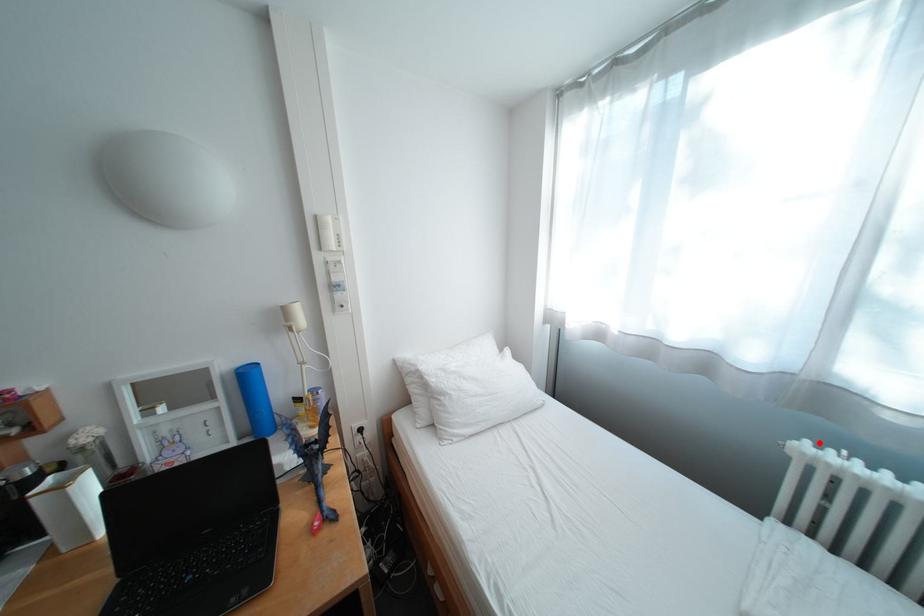
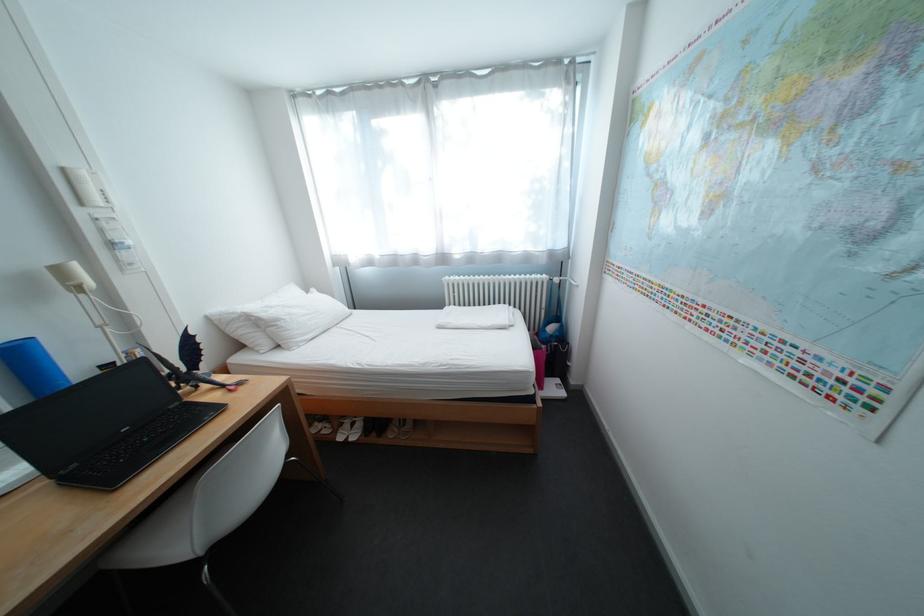
Find the pixel in the second image that matches the highlighted location in the first image.

(459, 278)